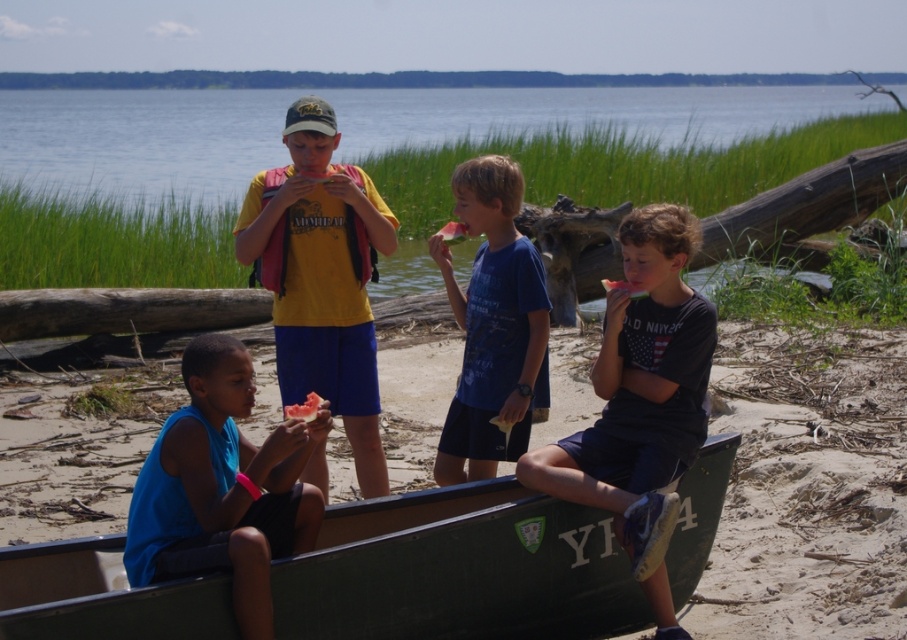
Question: Is blue fabric shirt at center smaller than yellow matte t-shirt at center?

Choices:
 (A) yes
 (B) no

Answer: (A)

Question: Which of the following is the closest to the observer?

Choices:
 (A) click(x=250, y=461)
 (B) click(x=318, y=323)
 (C) click(x=501, y=608)
 (D) click(x=658, y=550)

Answer: (A)

Question: Among these objects, which one is nearest to the camera?

Choices:
 (A) blue cotton shirt at center
 (B) blue fabric shirt at center

Answer: (B)

Question: Is green matte canoe at lower center smaller than yellow matte t-shirt at center?

Choices:
 (A) no
 (B) yes

Answer: (A)

Question: Which object appears farthest from the camera in this image?

Choices:
 (A) blue cotton shirt at center
 (B) yellow matte t-shirt at center

Answer: (B)

Question: Considering the relative positions of blue fabric shirt at center and yellow matte t-shirt at center in the image provided, where is blue fabric shirt at center located with respect to yellow matte t-shirt at center?

Choices:
 (A) below
 (B) above

Answer: (A)